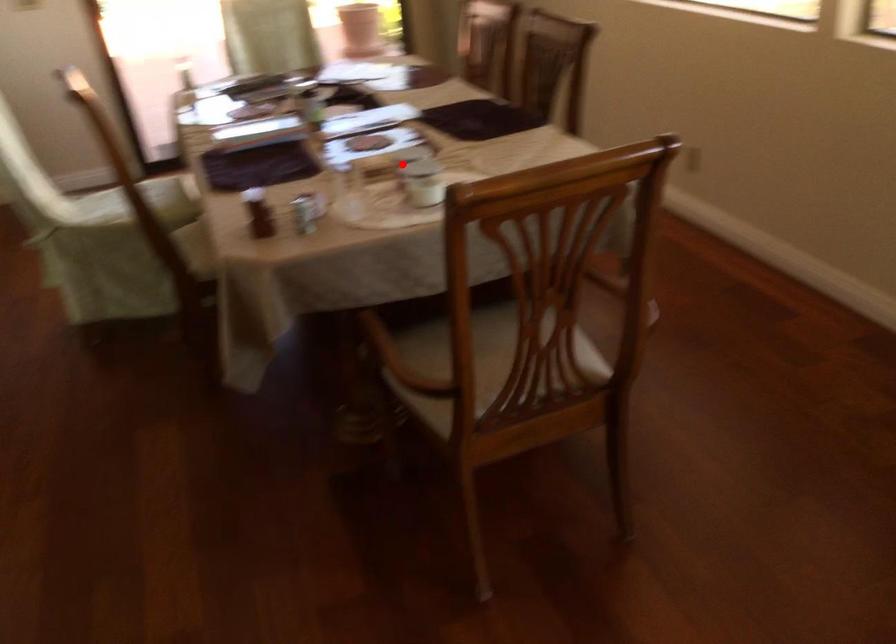
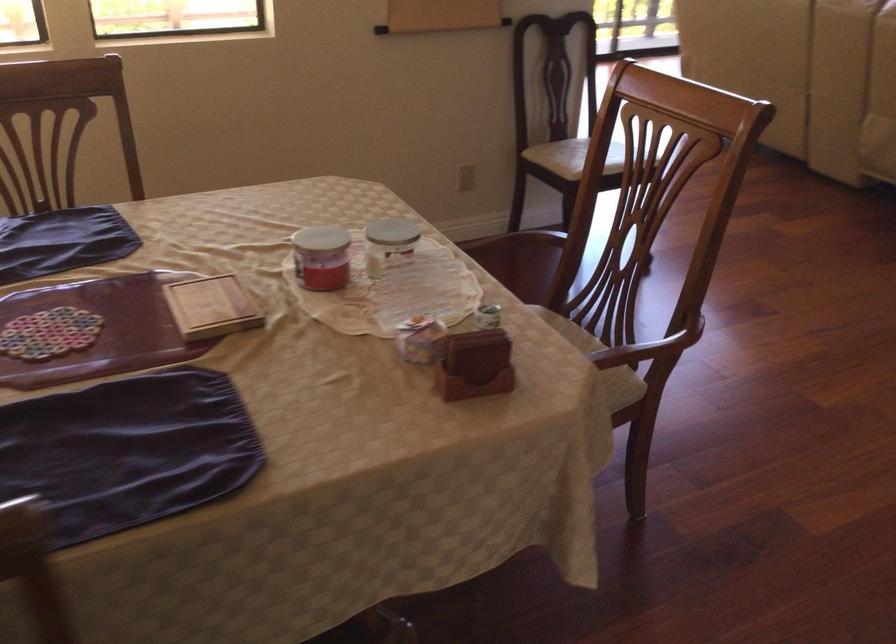
Question: I am providing you with two images of the same scene from different viewpoints. In image1, a red point is highlighted. Considering the same 3D point in image2, which of the following is correct?

Choices:
 (A) It is closer
 (B) It is farther

Answer: (A)